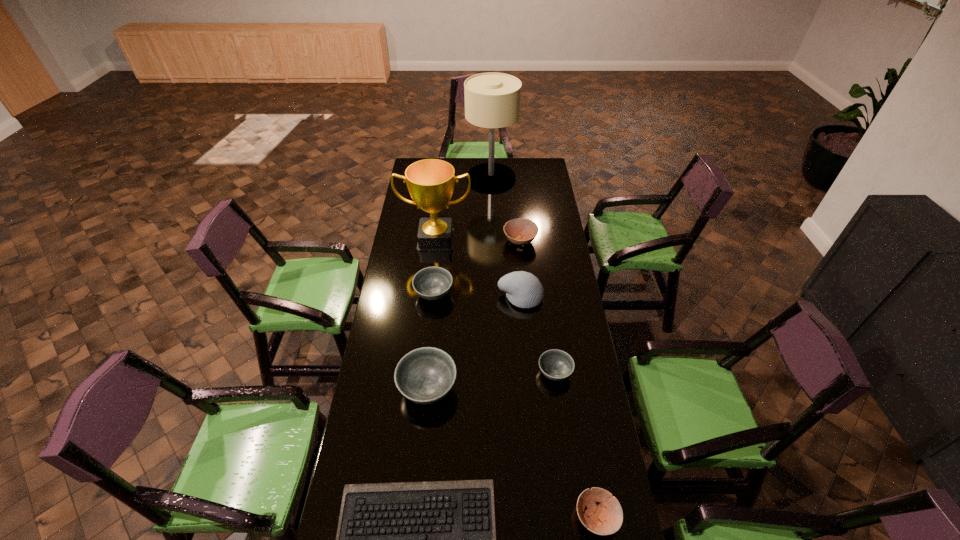
Identify the location of award present at the left edge. (430, 182).

Identify the location of beanie at the right edge. (523, 289).

Find the location of `free space at the far edge of the desktop`. free space at the far edge of the desktop is located at coordinates (518, 161).

This screenshot has width=960, height=540. In the image, there is a desktop. What are the coordinates of `free space at the left edge` in the screenshot? It's located at (387, 394).

Where is `vacant area at the right edge of the desktop`? This screenshot has width=960, height=540. vacant area at the right edge of the desktop is located at coordinates (570, 453).

You are a GUI agent. You are given a task and a screenshot of the screen. Output one action in this format:
    pyautogui.click(x=<x>, y=<y>)
    Task: Click on the free area in between the farthest bowl and the fourth tallest object
    The width and height of the screenshot is (960, 540).
    Given the screenshot: What is the action you would take?
    pyautogui.click(x=474, y=314)

Find the location of a particular element. The width and height of the screenshot is (960, 540). free area in between the smallest gray bowl and the second biggest gray bowl is located at coordinates [494, 333].

Locate an element on the screen. This screenshot has height=540, width=960. vacant area between the farther brown bowl and the farthest gray bowl is located at coordinates (477, 267).

Identify the location of vacant space that's between the second tallest object and the beanie. The width and height of the screenshot is (960, 540). (478, 268).

Image resolution: width=960 pixels, height=540 pixels. What are the coordinates of `free spot between the bigger brown bowl and the gray beanie` in the screenshot? It's located at (520, 269).